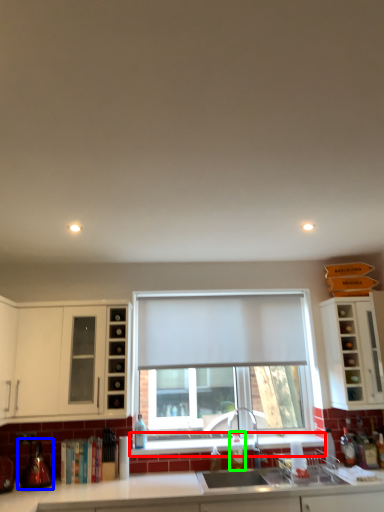
Question: Estimate the real-world distances between objects in this image. Which object is farther from window sill (highlighted by a red box), appliance (highlighted by a blue box) or bottle (highlighted by a green box)?

Choices:
 (A) appliance
 (B) bottle

Answer: (A)